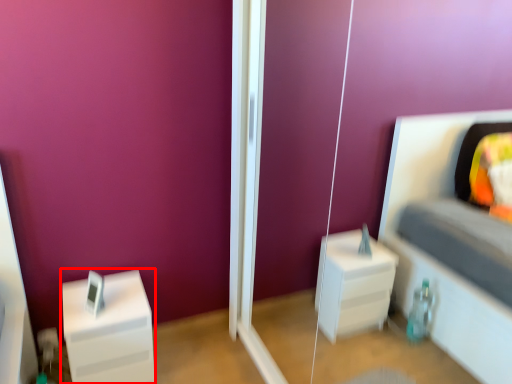
Question: From the image's perspective, where is furniture (annotated by the red box) located relative to glass door?

Choices:
 (A) above
 (B) below

Answer: (B)